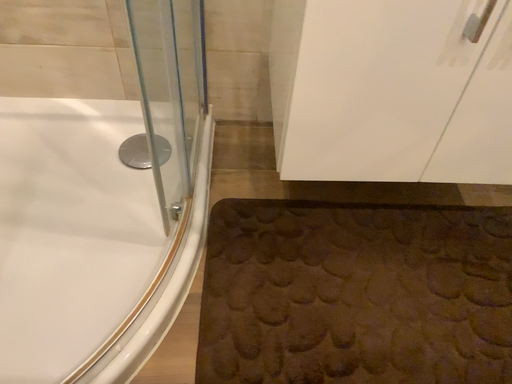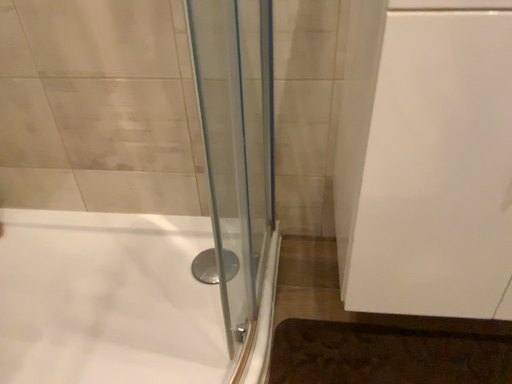
Question: Which way did the camera rotate in the video?

Choices:
 (A) rotated right
 (B) rotated left

Answer: (B)